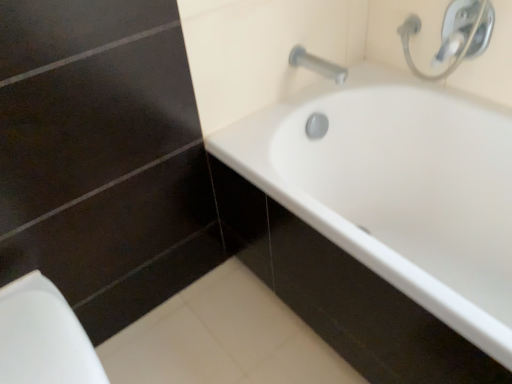
Question: Is white glossy porcelain at lower left bigger or smaller than white glossy bathtub at center?

Choices:
 (A) small
 (B) big

Answer: (A)

Question: In the image, is white glossy porcelain at lower left on the left side or the right side of white glossy bathtub at center?

Choices:
 (A) right
 (B) left

Answer: (B)

Question: Based on their relative distances, which object is nearer to the silver metallic faucet at upper right?

Choices:
 (A) white glossy bathtub at center
 (B) silver metallic tap at upper right
 (C) white glossy porcelain at lower left

Answer: (B)

Question: Based on their relative distances, which object is farther from the silver metallic tap at upper right?

Choices:
 (A) silver metallic faucet at upper right
 (B) white glossy bathtub at center
 (C) white glossy porcelain at lower left

Answer: (C)